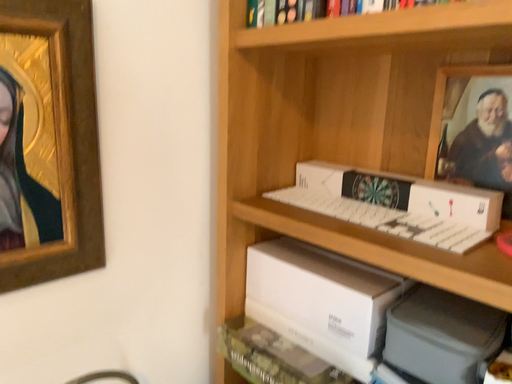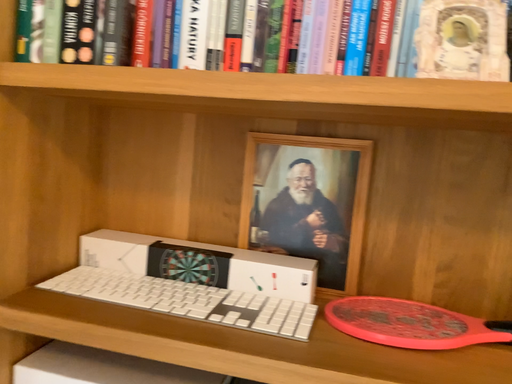
Question: Which way did the camera rotate in the video?

Choices:
 (A) rotated downward
 (B) rotated upward

Answer: (B)